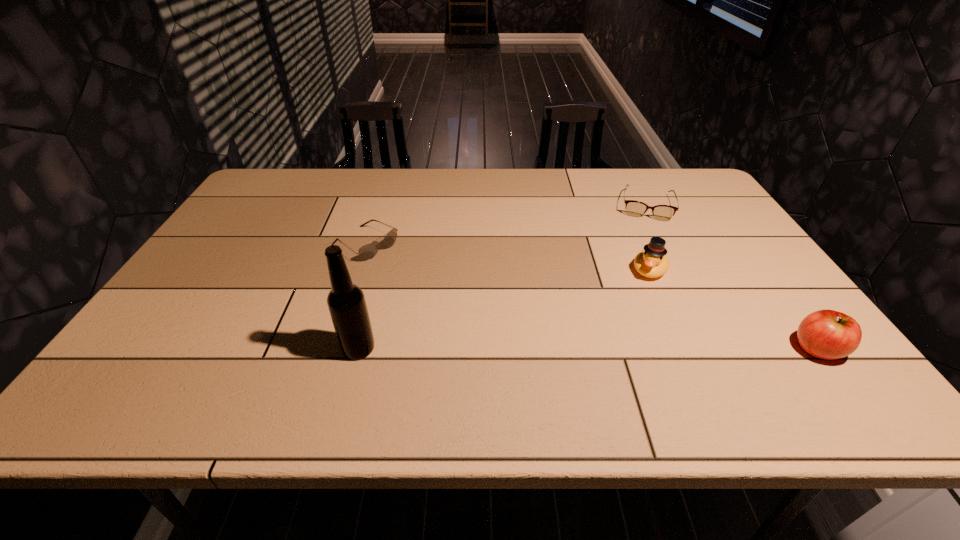
Where is `vacant space that satisfies the following two spatial constraints: 1. on the back side of the spectacles; 2. on the left side of the tallest object`? The width and height of the screenshot is (960, 540). vacant space that satisfies the following two spatial constraints: 1. on the back side of the spectacles; 2. on the left side of the tallest object is located at coordinates (396, 206).